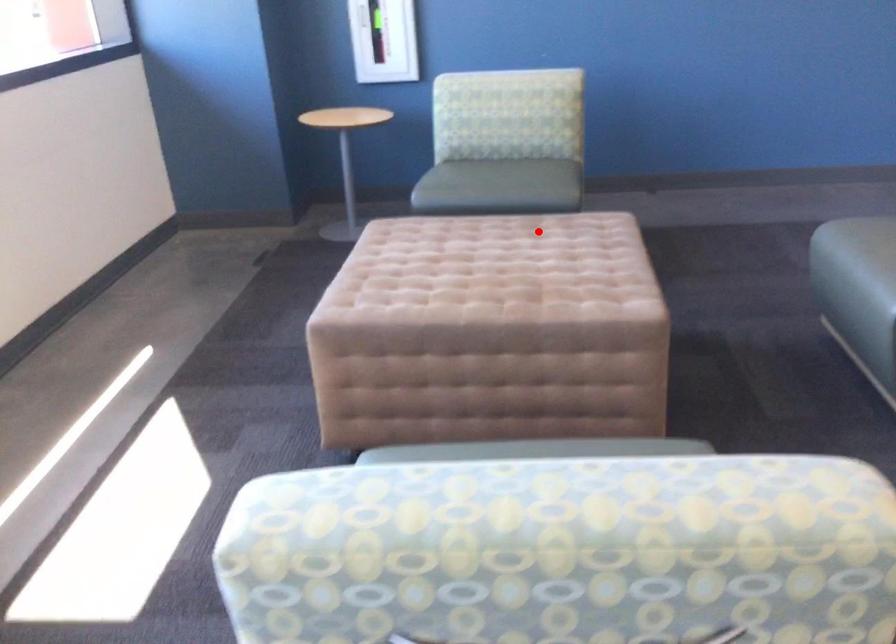
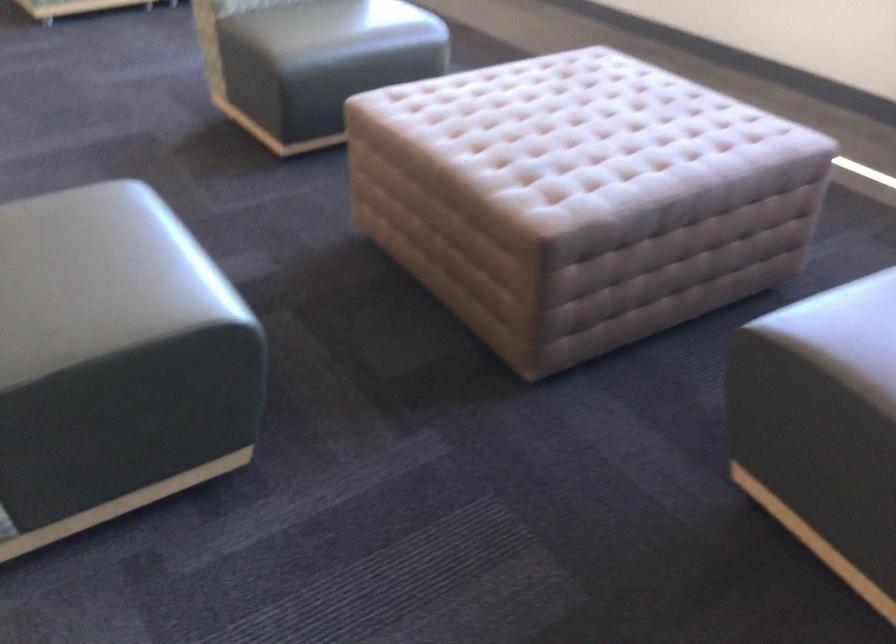
Question: I am providing you with two images of the same scene from different viewpoints. Given a red point in image1, look at the same physical point in image2. Is it:

Choices:
 (A) Closer to the viewpoint
 (B) Farther from the viewpoint

Answer: (A)